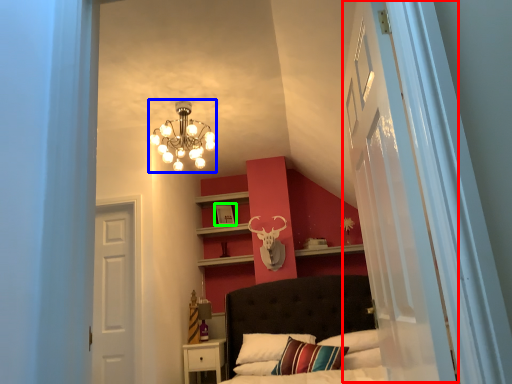
Question: Which object is positioned closest to glass door (highlighted by a red box)? Select from lamp (highlighted by a blue box) and picture frame (highlighted by a green box).

Choices:
 (A) lamp
 (B) picture frame

Answer: (A)